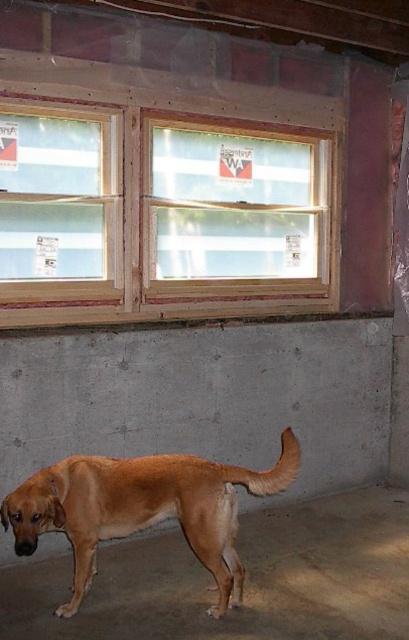
You are a painter standing in the room where the dog is. You want to paint the wooden frame at upper center marked by point [161,216]. Which direction should you move relative to the dog to reach it?

The wooden frame at upper center marked by point [161,216] is located above and slightly to the right of the dog. Since the dog is facing slightly to the left, you should move forward and to the right relative to the dog to reach the wooden frame at upper center.

You are a delivery person who needs to place a package on the floor near the clear glass window at center without blocking the wooden frame at upper left. Is there enough space between them to do this?

The clear glass window at center is 22.87 inches away from the wooden frame at upper left. Since the package requires minimal space, there should be enough room to place it near the clear glass window at center without obstructing the wooden frame at upper left.

You are a visitor in this indoor space and want to locate the wooden frame at upper center. According to the coordinates provided, where should you look?

You should look at point (161, 216) to locate the wooden frame at upper center.